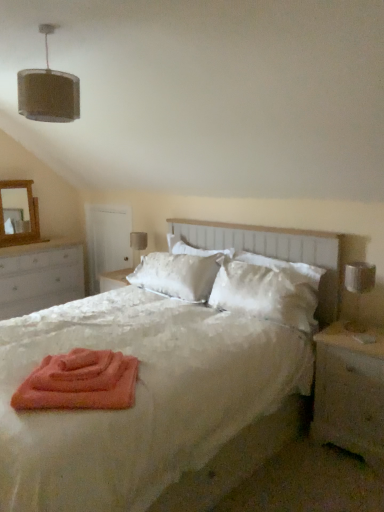
Question: Does satin white pillow at center have a lesser height compared to brown fabric lampshade at upper left?

Choices:
 (A) yes
 (B) no

Answer: (B)

Question: Is the position of satin white pillow at center more distant than that of brown fabric lampshade at upper left?

Choices:
 (A) no
 (B) yes

Answer: (B)

Question: Does satin white pillow at center have a smaller size compared to brown fabric lampshade at upper left?

Choices:
 (A) no
 (B) yes

Answer: (A)

Question: Does satin white pillow at center have a greater height compared to brown fabric lampshade at upper left?

Choices:
 (A) yes
 (B) no

Answer: (A)

Question: Is satin white pillow at center to the left of brown fabric lampshade at upper left from the viewer's perspective?

Choices:
 (A) yes
 (B) no

Answer: (B)

Question: In the image, is wooden nightstand at right, which is the 1th nightstand from front to back, positioned in front of or behind satin white pillow at center?

Choices:
 (A) front
 (B) behind

Answer: (A)

Question: From a real-world perspective, relative to satin white pillow at center, is wooden nightstand at right, the 2th nightstand viewed from the back, vertically above or below?

Choices:
 (A) above
 (B) below

Answer: (B)

Question: From the image's perspective, relative to satin white pillow at center, is wooden nightstand at right, which is the 1th nightstand from front to back, above or below?

Choices:
 (A) above
 (B) below

Answer: (B)

Question: Is wooden nightstand at right, which is the 1th nightstand from front to back, inside the boundaries of satin white pillow at center, or outside?

Choices:
 (A) inside
 (B) outside

Answer: (B)

Question: Visually, is white wood dresser at left, the 2th nightstand positioned from the right, positioned to the left or to the right of white satin headboard at center?

Choices:
 (A) left
 (B) right

Answer: (A)

Question: Looking at the image, does white wood dresser at left, acting as the 1th nightstand starting from the back, seem bigger or smaller compared to white satin headboard at center?

Choices:
 (A) small
 (B) big

Answer: (B)

Question: Is white wood dresser at left, arranged as the second nightstand when viewed from the front, wider or thinner than white satin headboard at center?

Choices:
 (A) thin
 (B) wide

Answer: (B)

Question: Would you say white wood dresser at left, the 2th nightstand positioned from the right, is inside or outside white satin headboard at center?

Choices:
 (A) inside
 (B) outside

Answer: (B)

Question: From their relative heights in the image, would you say silver metallic table lamp at right, the first table lamp when ordered from right to left, is taller or shorter than wooden nightstand at right, which is the first nightstand from right to left?

Choices:
 (A) short
 (B) tall

Answer: (A)

Question: From the image's perspective, is silver metallic table lamp at right, placed as the first table lamp when sorted from front to back, located above or below wooden nightstand at right, which is the 1th nightstand from front to back?

Choices:
 (A) above
 (B) below

Answer: (A)